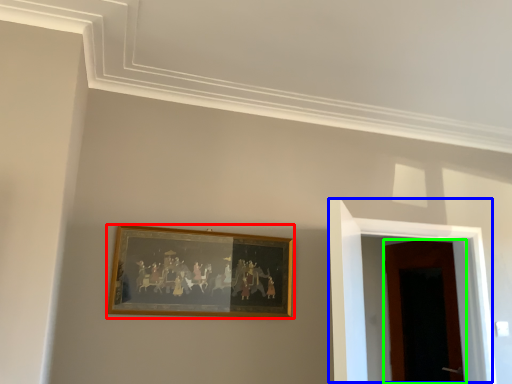
Question: Which is farther away from picture frame (highlighted by a red box)? door (highlighted by a blue box) or door (highlighted by a green box)?

Choices:
 (A) door
 (B) door

Answer: (B)